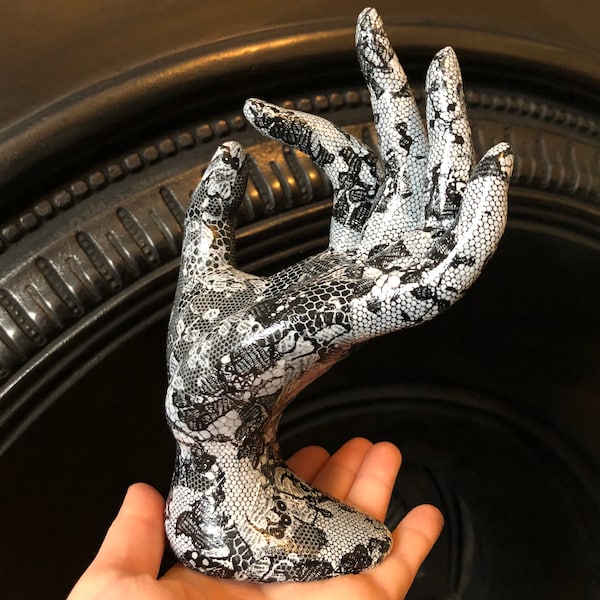
At what (x,y) coordinates should I click in order to perform the action: click on piece of art. Please return your answer as a coordinate pair (x, y). The height and width of the screenshot is (600, 600). Looking at the image, I should click on (236, 331).